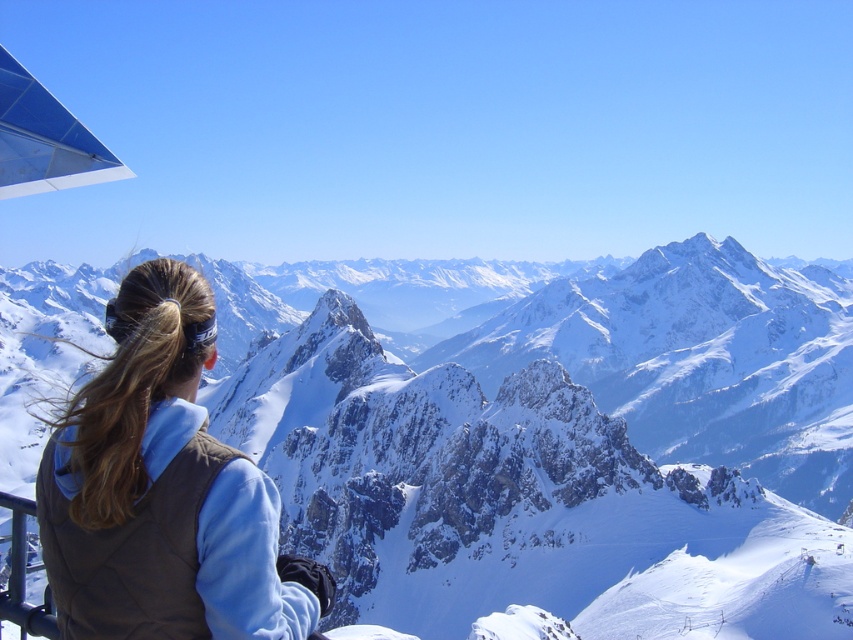
Based on the photo, is white snow-covered mountain range at upper center smaller than brown fleece vest at center?

No.

How much distance is there between white snow-covered mountain range at upper center and brown fleece vest at center?

A distance of 392.81 feet exists between white snow-covered mountain range at upper center and brown fleece vest at center.

Measure the distance between point (473, 534) and camera.

They are 101.73 meters apart.

The image size is (853, 640). Find the location of `white snow-covered mountain range at upper center`. white snow-covered mountain range at upper center is located at coordinates (564, 449).